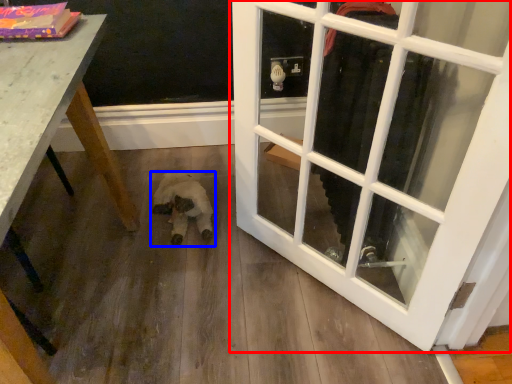
Question: Among these objects, which one is farthest to the camera, door (highlighted by a red box) or animal (highlighted by a blue box)?

Choices:
 (A) door
 (B) animal

Answer: (B)